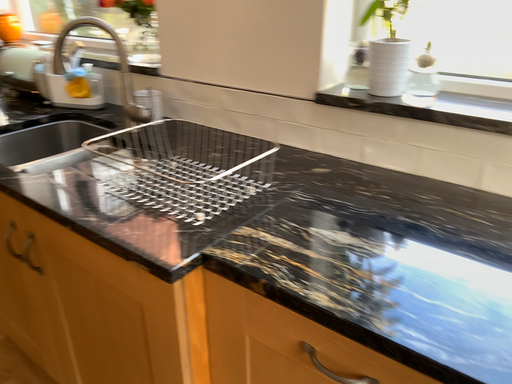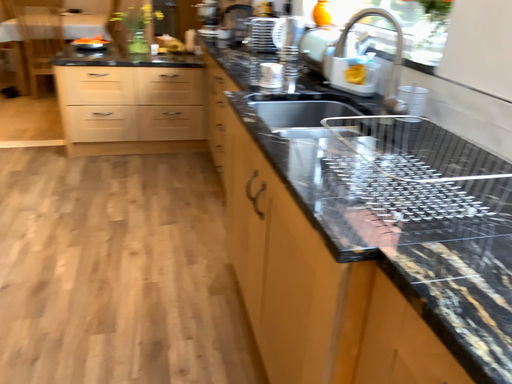
Question: Which way did the camera rotate in the video?

Choices:
 (A) rotated right
 (B) rotated left

Answer: (B)